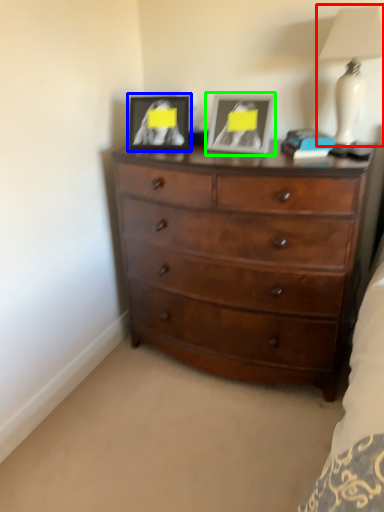
Question: Which object is the closest to the lamp (highlighted by a red box)? Choose among these: picture frame (highlighted by a blue box) or picture frame (highlighted by a green box).

Choices:
 (A) picture frame
 (B) picture frame

Answer: (B)